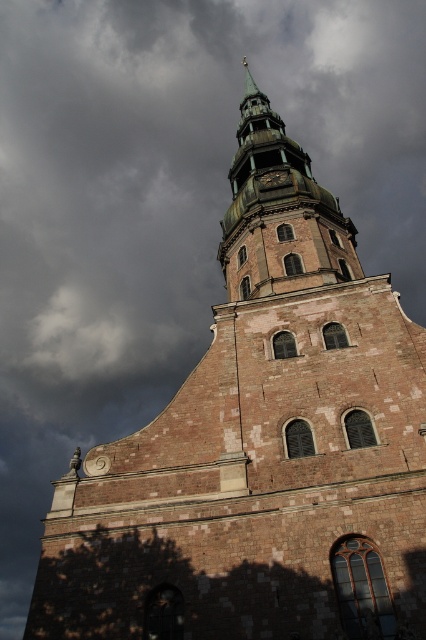
Question: In this image, where is brick steeple at upper center located relative to dark brown wooden clock at center?

Choices:
 (A) right
 (B) left

Answer: (A)

Question: In this image, where is brick steeple at upper center located relative to dark brown wooden clock at center?

Choices:
 (A) right
 (B) left

Answer: (A)

Question: Which object is closer to the camera taking this photo?

Choices:
 (A) brick steeple at upper center
 (B) dark brown wooden clock at center

Answer: (A)

Question: Which point is closer to the camera taking this photo?

Choices:
 (A) (350, 237)
 (B) (273, 177)

Answer: (A)

Question: Is brick steeple at upper center to the right of dark brown wooden clock at center from the viewer's perspective?

Choices:
 (A) yes
 (B) no

Answer: (A)